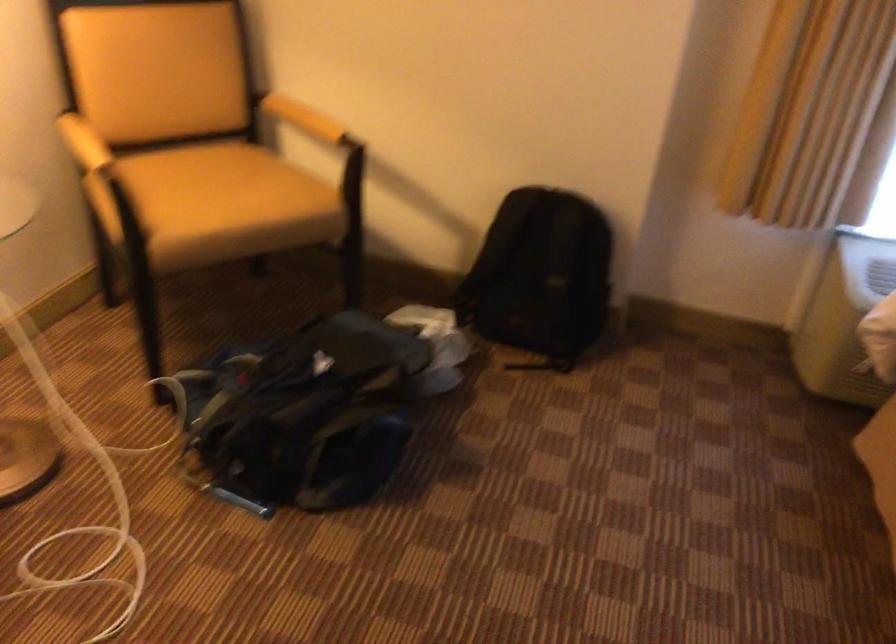
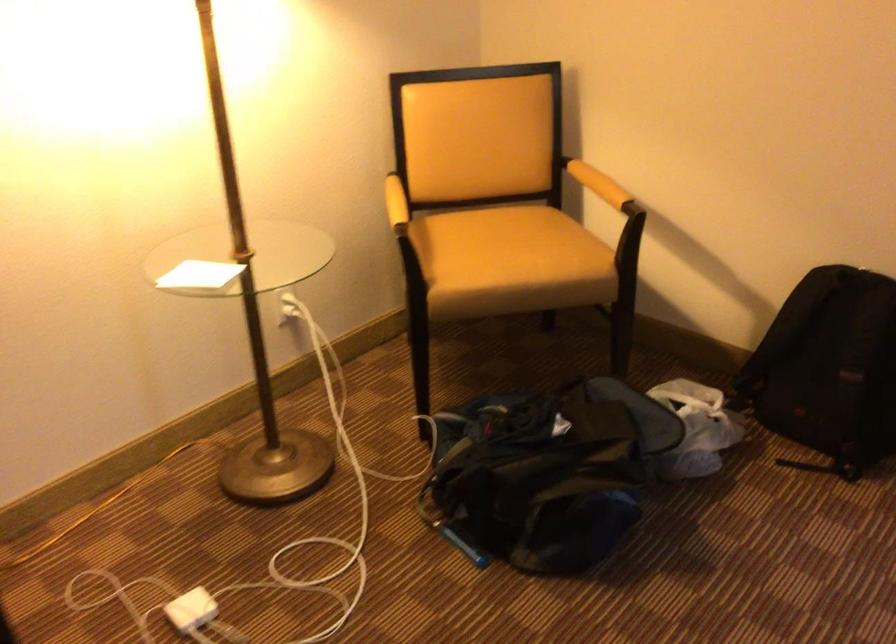
Question: In a continuous first-person perspective shot, in which direction is the camera moving?

Choices:
 (A) Left
 (B) Right
 (C) Forward
 (D) Backward

Answer: (B)